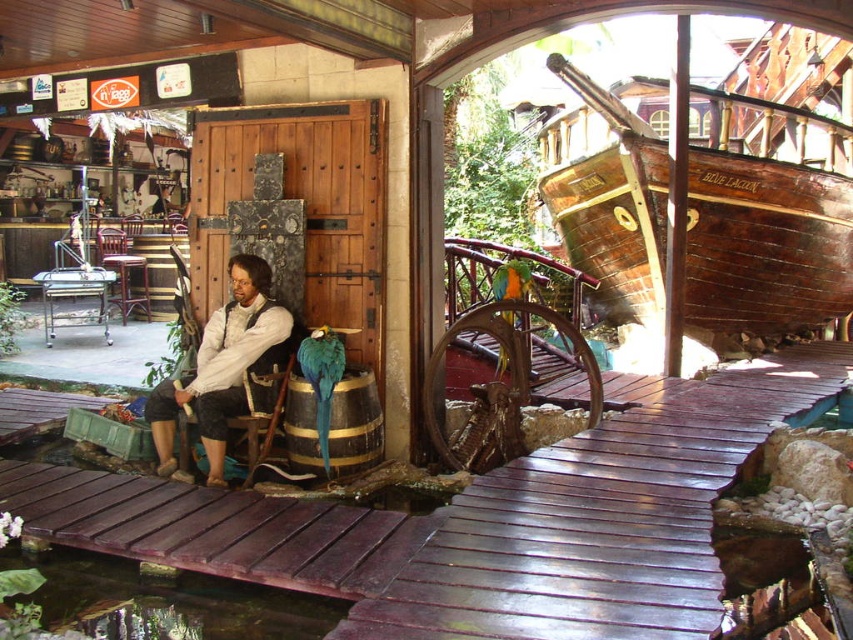
Question: In this image, where is shiny brown wood dock at center located relative to wooden at left?

Choices:
 (A) below
 (B) above

Answer: (A)

Question: Does shiny brown wood dock at center appear over white matte shirt at center?

Choices:
 (A) yes
 (B) no

Answer: (B)

Question: Which is nearer to the metallic silver chair at left?

Choices:
 (A) mahogany wood chair at left
 (B) wooden ship at right
 (C) white matte shirt at center

Answer: (A)

Question: Is shiny brown wood dock at center above white matte shirt at center?

Choices:
 (A) yes
 (B) no

Answer: (B)

Question: Which object is the closest to the mahogany wood chair at left?

Choices:
 (A) white matte shirt at center
 (B) shiny brown wood dock at center
 (C) wooden ship at right

Answer: (C)

Question: Among these objects, which one is nearest to the camera?

Choices:
 (A) wooden ship at right
 (B) white matte shirt at center
 (C) shiny brown wood dock at center
 (D) wooden at left

Answer: (C)